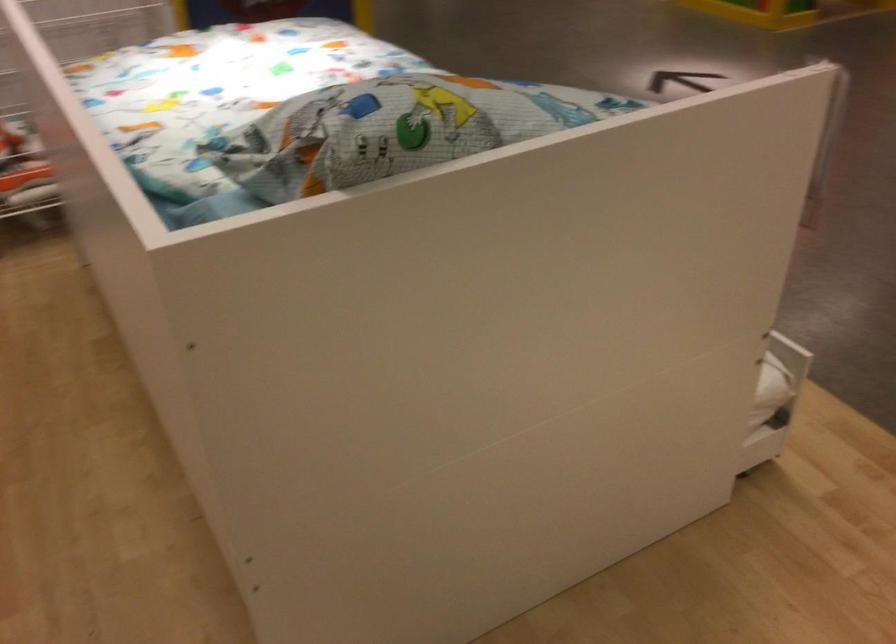
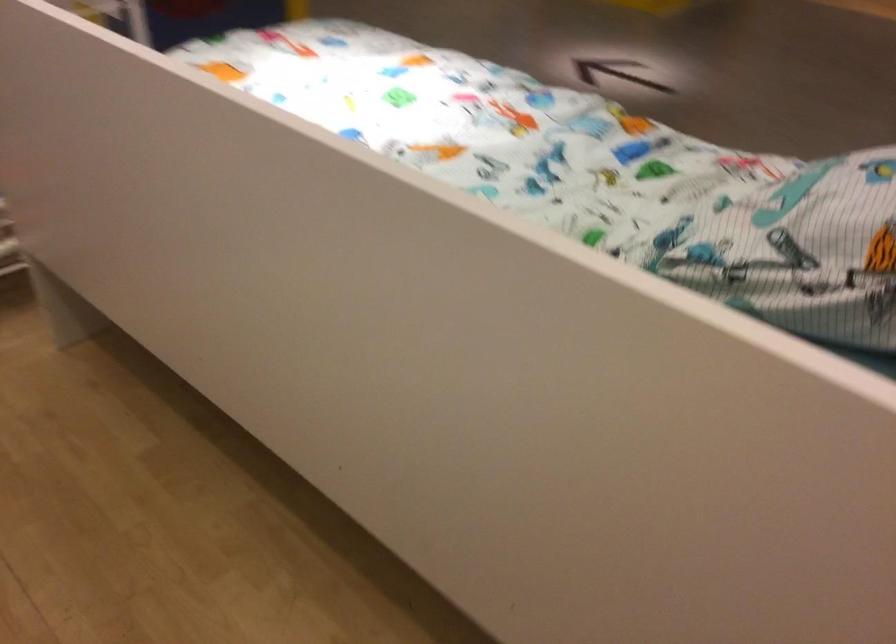
Question: The first image is from the beginning of the video and the second image is from the end. How did the camera likely rotate when shooting the video?

Choices:
 (A) Left
 (B) Right
 (C) Up
 (D) Down

Answer: (B)